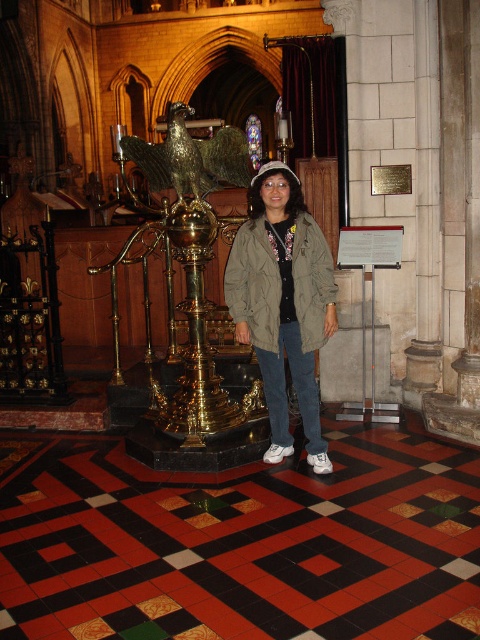
You are standing at the entrance of the cathedral and want to take a photo of the person dressed in a light olive green jacket and white cap. Which point, point 1 at coordinates (289, 346) or point 2 at coordinates (335, 292), should you stand closer to in order to have the person in the foreground of your photo?

To have the person in the foreground, you should stand closer to point 2 at coordinates (335, 292) because point 1 is behind point 2, so being closer to point 2 places the person nearer to the camera.

You are standing at point (196, 189) and want to walk to the golden lectern. There is a person at point (249, 330) blocking your path. Can you walk around them to reach the lectern?

Point (249, 330) is in front of point (196, 189), so the person at point (249, 330) is blocking your path. You can walk around them to reach the lectern.